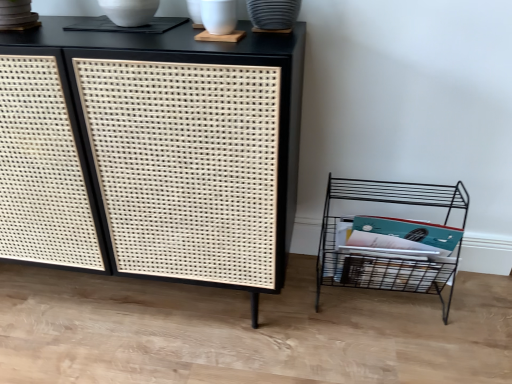
Locate an element on the screen. space that is in front of black wire shelf at lower right is located at coordinates (397, 353).